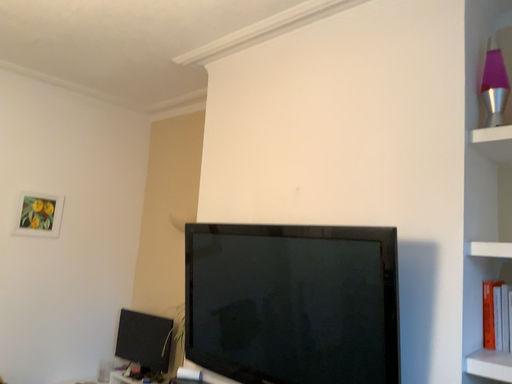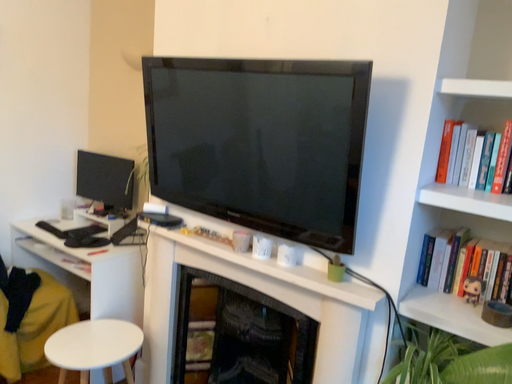
Question: How did the camera likely rotate when shooting the video?

Choices:
 (A) rotated downward
 (B) rotated upward

Answer: (A)